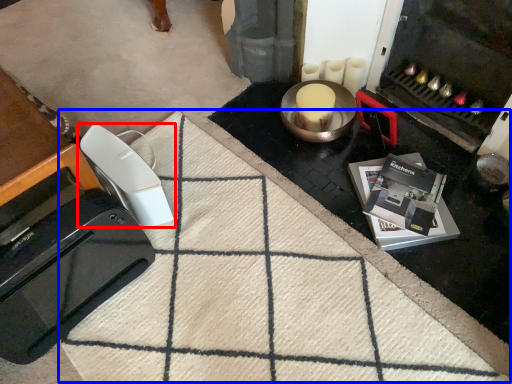
Question: Which object is further to the camera taking this photo, home appliance (highlighted by a red box) or doormat (highlighted by a blue box)?

Choices:
 (A) home appliance
 (B) doormat

Answer: (A)